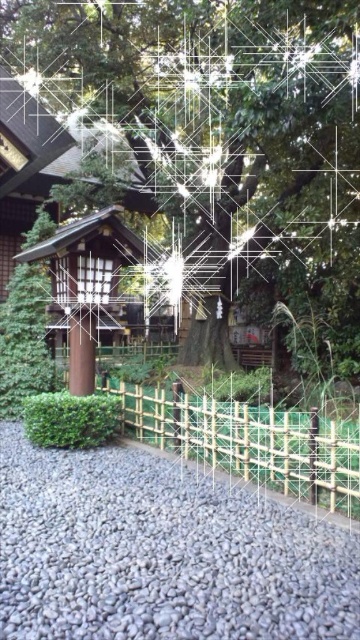
Question: Is green leafy tree at center thinner than green bamboo fence at center?

Choices:
 (A) no
 (B) yes

Answer: (A)

Question: Which of these objects is positioned farthest from the green leafy tree at center?

Choices:
 (A) green bamboo fence at center
 (B) gray gravel at lower center

Answer: (B)

Question: Which point is farther to the camera?

Choices:
 (A) gray gravel at lower center
 (B) green leafy tree at center

Answer: (B)

Question: Considering the relative positions of green leafy tree at center and gray gravel at lower center in the image provided, where is green leafy tree at center located with respect to gray gravel at lower center?

Choices:
 (A) above
 (B) below

Answer: (A)

Question: Does green leafy tree at center appear over green bamboo fence at center?

Choices:
 (A) yes
 (B) no

Answer: (A)

Question: Among these points, which one is farthest from the camera?

Choices:
 (A) (186, 285)
 (B) (358, 490)

Answer: (A)